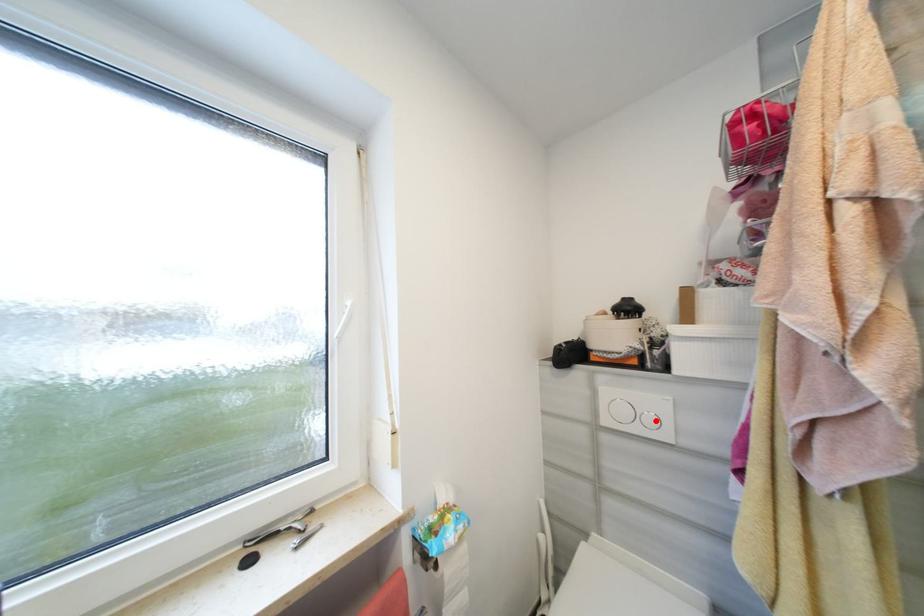
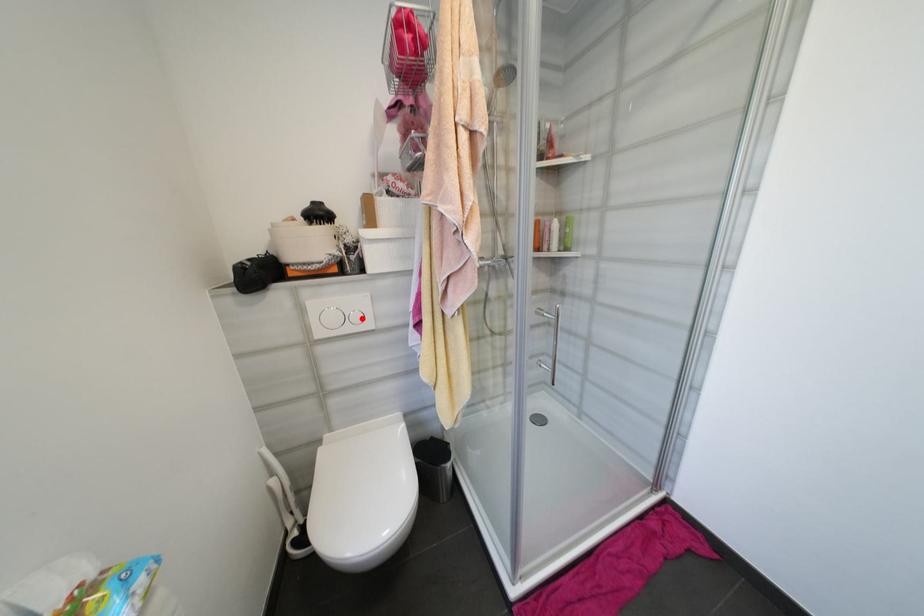
I am providing you with two images of the same scene from different viewpoints. A red point is marked on the first image and another point is marked on the second image. Does the point marked in image1 correspond to the same location as the one in image2?

Yes